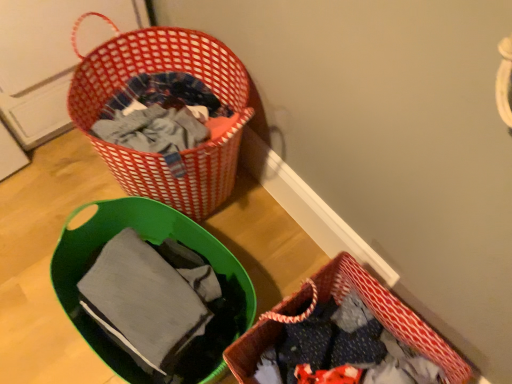
The width and height of the screenshot is (512, 384). What are the coordinates of `vacant space positioned to the left of red woven basket at upper left, placed as the first picnic basket when sorted from left to right` in the screenshot? It's located at (59, 192).